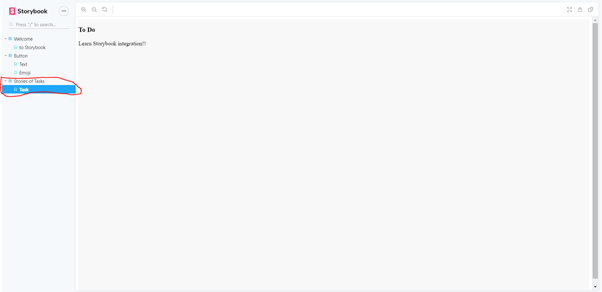
This screenshot has width=602, height=292. I want to click on tab with welcome information, so pos(25,37).